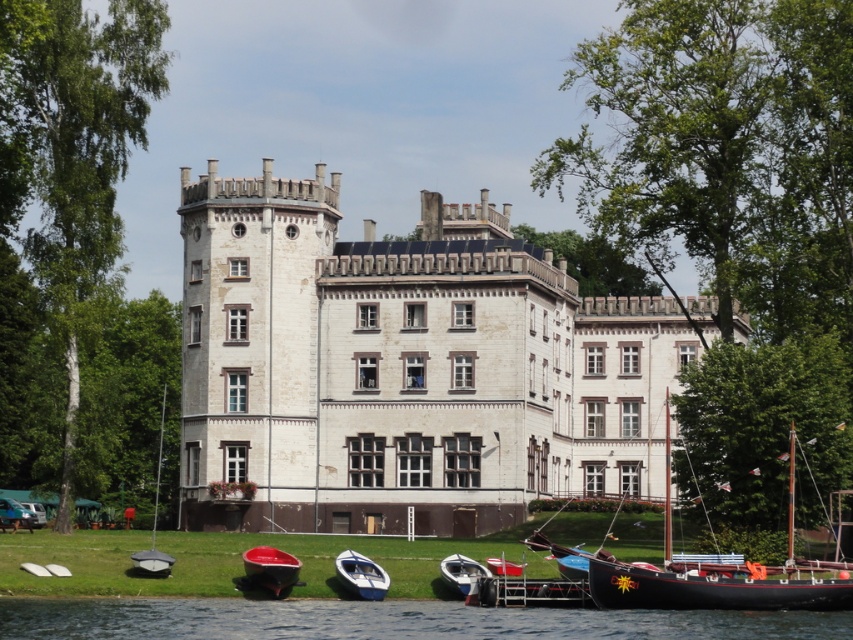
Question: Which of the following is the farthest from the observer?

Choices:
 (A) (606, 592)
 (B) (271, 563)
 (C) (517, 573)

Answer: (B)

Question: Which of the following is the closest to the observer?

Choices:
 (A) metallic red boat at lower center
 (B) wooden sailboat at lower right

Answer: (B)

Question: Can you confirm if wooden sailboat at lower right is wider than white plastic boat at lower center?

Choices:
 (A) yes
 (B) no

Answer: (A)

Question: Can you confirm if wooden sailboat at lower right is positioned above white glossy boat at lower center?

Choices:
 (A) no
 (B) yes

Answer: (B)

Question: Which object is positioned closest to the white stone castle at center?

Choices:
 (A) metallic gray sailboat at lower left
 (B) white glossy boat at lower center

Answer: (A)

Question: Does transparent water at lower center have a larger size compared to metallic gray sailboat at lower left?

Choices:
 (A) no
 (B) yes

Answer: (A)